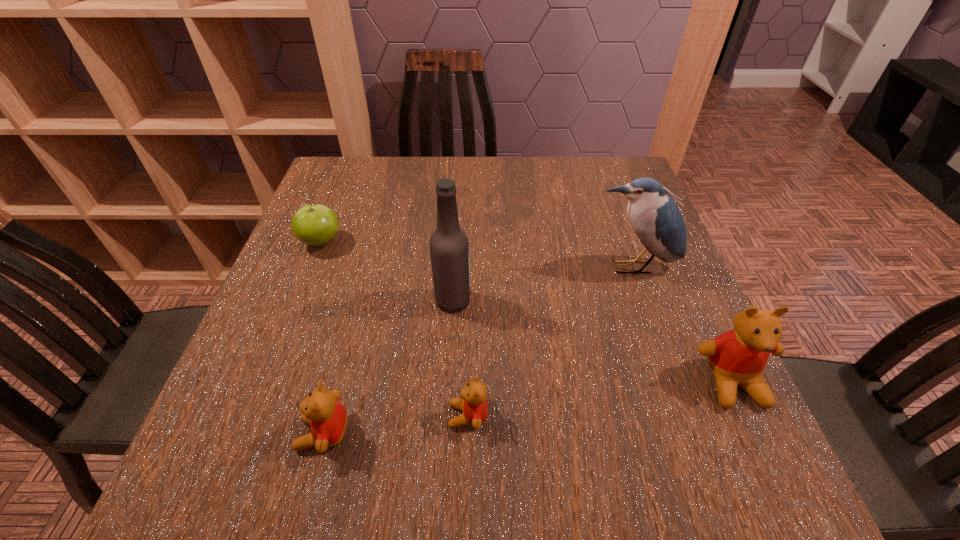
Identify the location of the closest teddy bear relative to the apple. (327, 417).

Image resolution: width=960 pixels, height=540 pixels. I want to click on the third closest teddy bear to the third farthest object, so click(738, 357).

Locate an element on the screen. This screenshot has height=540, width=960. vacant region that satisfies the following two spatial constraints: 1. at the tip of the bird's beak; 2. on the front-facing side of the leftmost teddy bear is located at coordinates (691, 434).

This screenshot has width=960, height=540. I want to click on vacant region that satisfies the following two spatial constraints: 1. on the front-facing side of the fourth shortest object; 2. on the front-facing side of the shortest teddy bear, so click(748, 416).

Identify the location of vacant area that satisfies the following two spatial constraints: 1. at the tip of the fifth shortest object's beak; 2. on the front-facing side of the shortest object. Image resolution: width=960 pixels, height=540 pixels. (685, 416).

This screenshot has height=540, width=960. I want to click on free space that satisfies the following two spatial constraints: 1. on the front-facing side of the third tallest object; 2. on the front-facing side of the shortest object, so click(x=748, y=416).

Locate an element on the screen. The image size is (960, 540). free point that satisfies the following two spatial constraints: 1. on the front-facing side of the tallest teddy bear; 2. on the front-facing side of the shortest teddy bear is located at coordinates (748, 416).